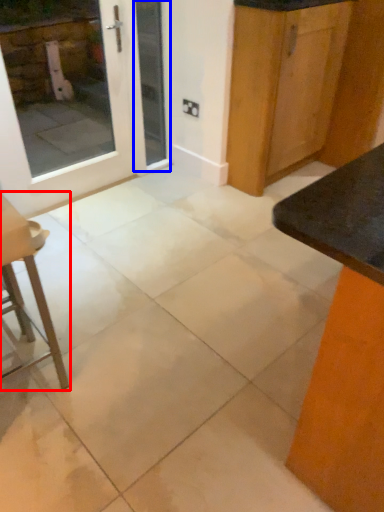
Question: Which object is closer to the camera taking this photo, furniture (highlighted by a red box) or screen door (highlighted by a blue box)?

Choices:
 (A) furniture
 (B) screen door

Answer: (A)